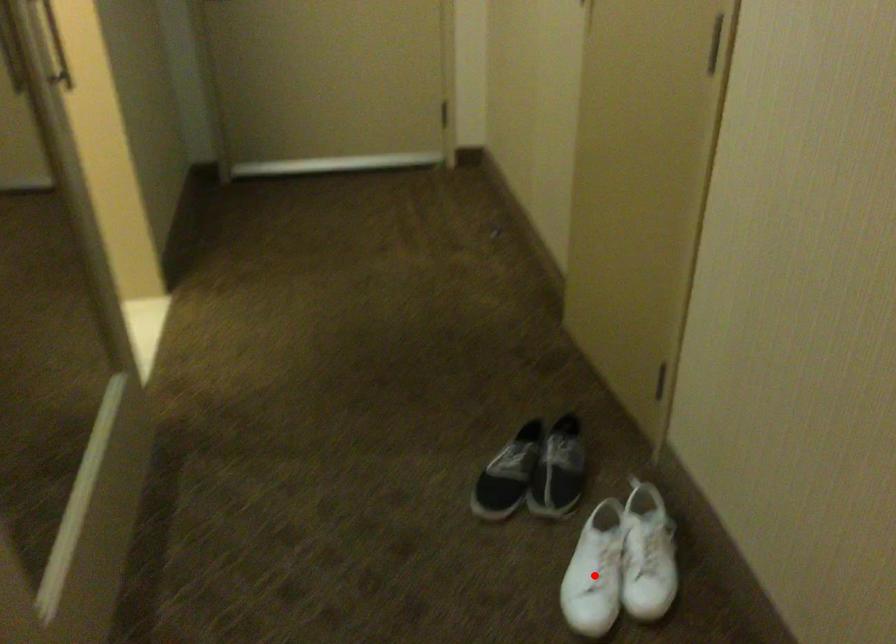
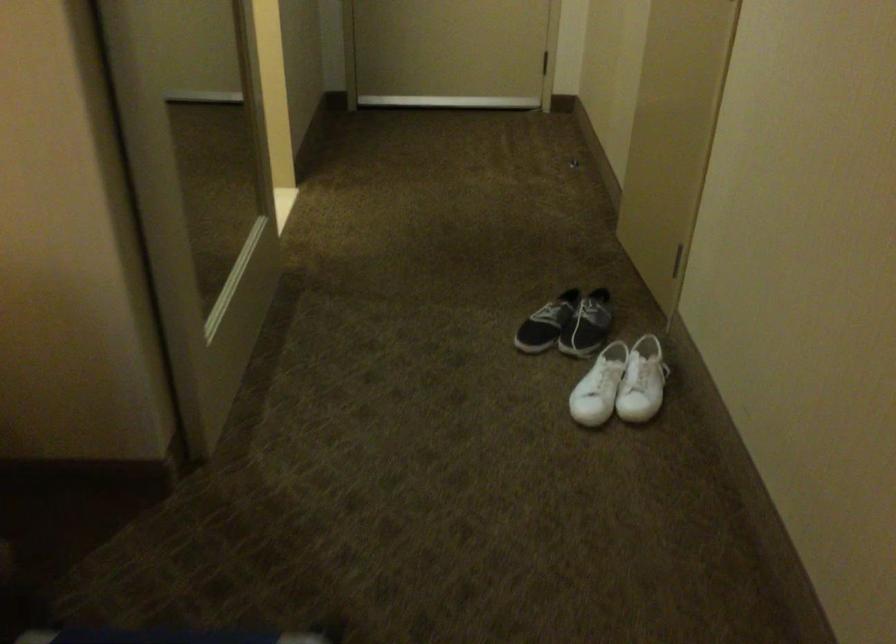
Question: A red point is marked in image1. In image2, is the corresponding 3D point closer to the camera or farther? Reply with the corresponding letter.

Choices:
 (A) The corresponding 3D point is closer.
 (B) The corresponding 3D point is farther.

Answer: (B)